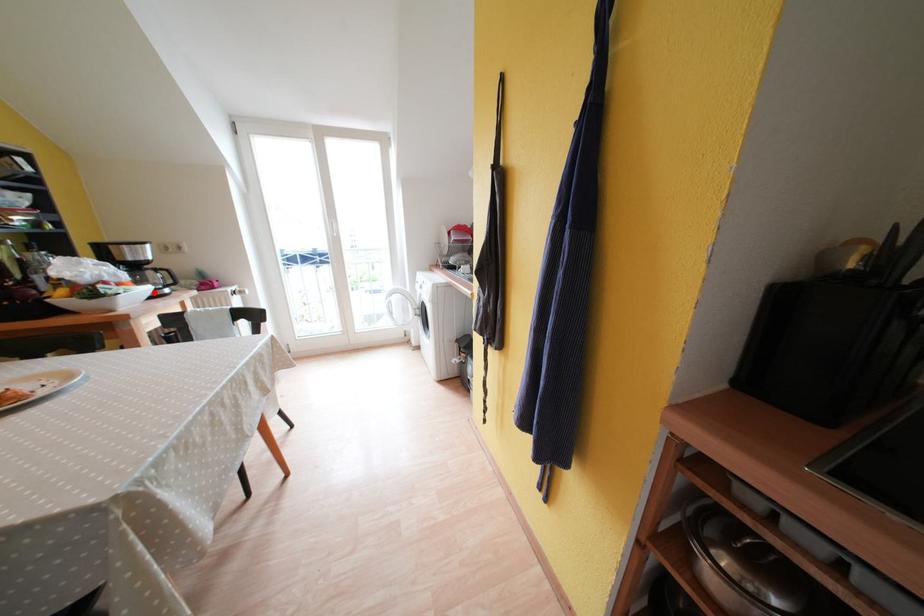
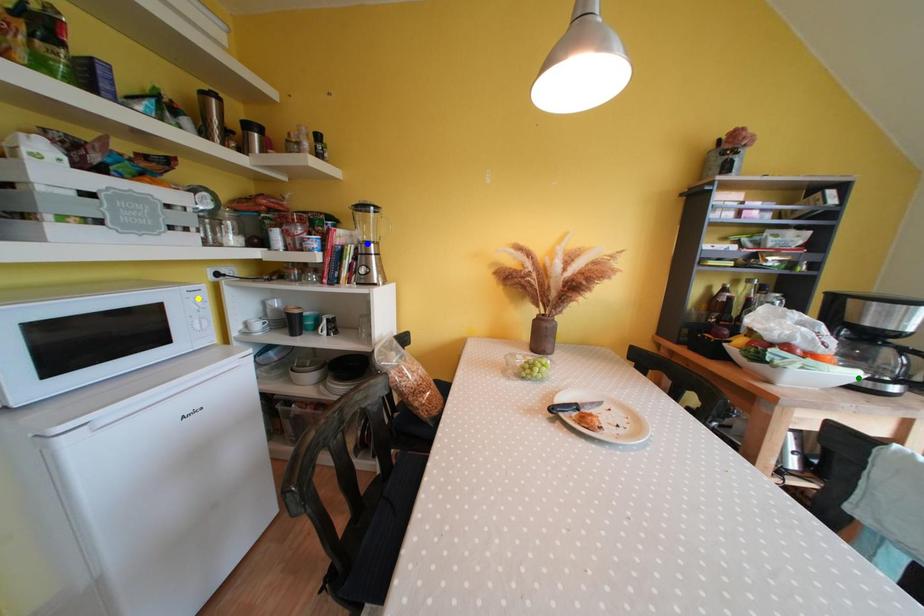
Question: I am providing you with two images of the same scene from different viewpoints. A red point is marked on the first image. You are given multiple points on the second image. Which point in image 2 represents the same 3d spot as the red point in image 1?

Choices:
 (A) blue point
 (B) green point
 (C) yellow point

Answer: (B)